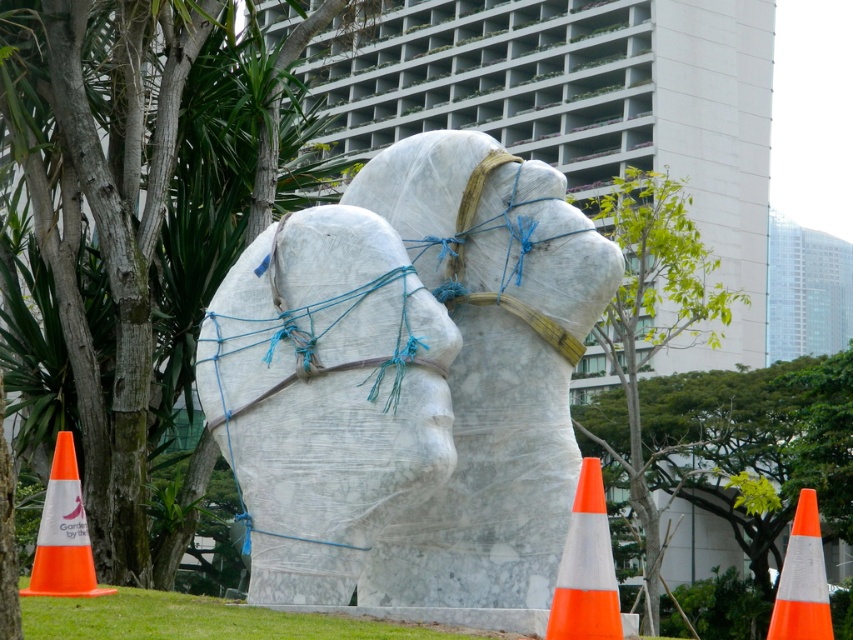
Question: Which point is closer to the camera taking this photo?

Choices:
 (A) (62, 429)
 (B) (805, 493)
 (C) (613, 605)

Answer: (C)

Question: Does orange/white traffic cone at lower right have a greater width compared to orange plastic traffic cone at lower left?

Choices:
 (A) yes
 (B) no

Answer: (B)

Question: Is orange plastic traffic cone at lower left smaller than orange reflective cone at lower right?

Choices:
 (A) no
 (B) yes

Answer: (A)

Question: Estimate the real-world distances between objects in this image. Which object is closer to the orange plastic traffic cone at lower left?

Choices:
 (A) orange/white traffic cone at lower right
 (B) orange reflective cone at lower right
 (C) white marble statue at center

Answer: (C)

Question: Can you confirm if white marble statue at center is positioned to the right of orange plastic traffic cone at lower left?

Choices:
 (A) yes
 (B) no

Answer: (A)

Question: Which point appears closest to the camera in this image?

Choices:
 (A) (36, 545)
 (B) (605, 608)
 (C) (813, 625)

Answer: (B)